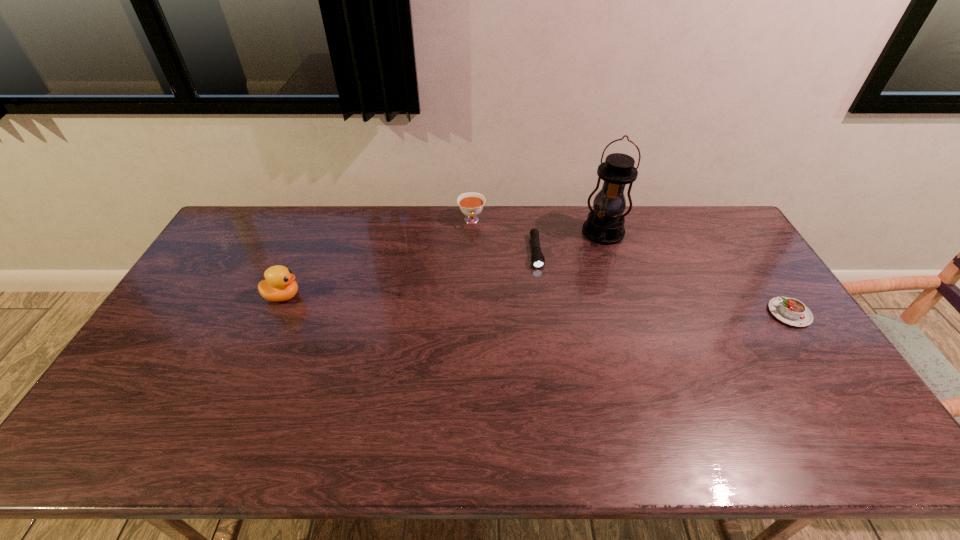
You are a GUI agent. You are given a task and a screenshot of the screen. Output one action in this format:
    pyautogui.click(x=<x>, y=<y>)
    Task: Click on the free space located 0.100m at the lens end of the third object from right to left
    
    Given the screenshot: What is the action you would take?
    pyautogui.click(x=540, y=292)

Where is `blank space located 0.350m at the lens end of the third object from right to left`? blank space located 0.350m at the lens end of the third object from right to left is located at coordinates (549, 356).

You are a GUI agent. You are given a task and a screenshot of the screen. Output one action in this format:
    pyautogui.click(x=<x>, y=<y>)
    Task: Click on the vacant region located at the lens end of the third object from right to left
    The height and width of the screenshot is (540, 960).
    Given the screenshot: What is the action you would take?
    pyautogui.click(x=548, y=345)

Point to any free space located 0.110m above the second object from right to left, indicating its light source in the image. Please provide its 2D coordinates. Your answer should be formatted as a tuple, i.e. [(x, y)], where the tuple contains the x and y coordinates of a point satisfying the conditions above.

[(597, 267)]

Locate several points within vacant space located 0.220m above the second object from right to left, indicating its light source. Please provide its 2D coordinates. Your answer should be formatted as a tuple, i.e. [(x, y)], where the tuple contains the x and y coordinates of a point satisfying the conditions above.

[(593, 289)]

Where can I find a free point located above the second object from right to left, indicating its light source? Please provide its 2D coordinates. Your answer should be formatted as a tuple, i.e. [(x, y)], where the tuple contains the x and y coordinates of a point satisfying the conditions above.

[(589, 307)]

Locate an element on the screen. The width and height of the screenshot is (960, 540). vacant space located 0.220m on the side of the teacup with the handle is located at coordinates (475, 272).

Locate an element on the screen. vacant space positioned 0.190m on the side of the teacup with the handle is located at coordinates (474, 266).

Where is `free space located on the side of the teacup with the handle`? This screenshot has width=960, height=540. free space located on the side of the teacup with the handle is located at coordinates (474, 266).

I want to click on flashlight located at the far edge, so click(x=537, y=258).